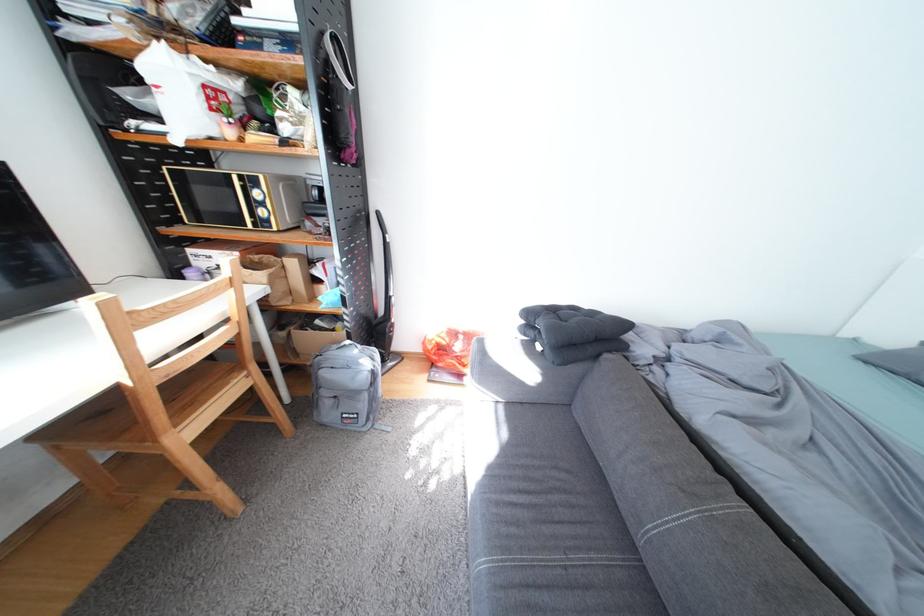
Identify the location of wooden chair sitting surface. The width and height of the screenshot is (924, 616). (111, 410).